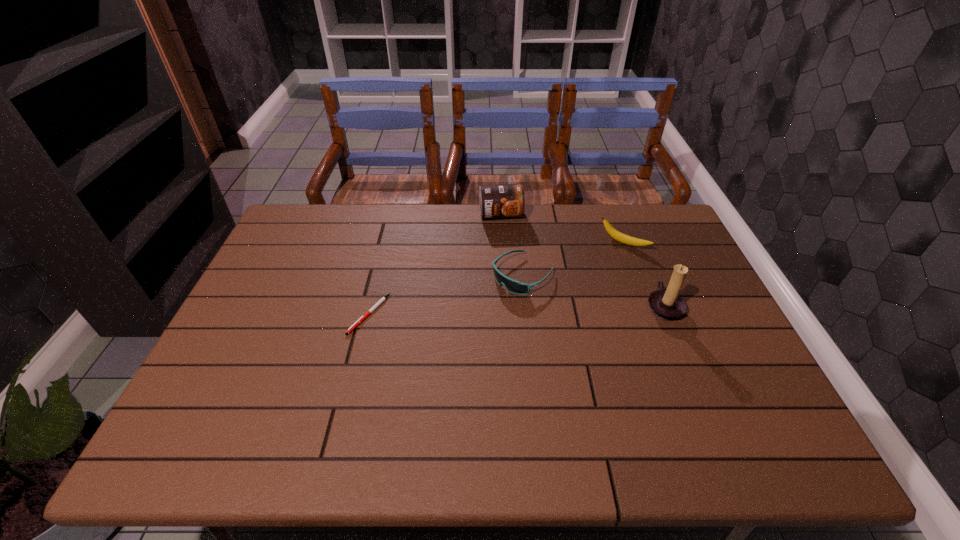
Where is `the shortest object`? The width and height of the screenshot is (960, 540). the shortest object is located at coordinates (382, 299).

Identify the location of pen. (382, 299).

Locate an element on the screen. candle holder is located at coordinates (668, 305).

The width and height of the screenshot is (960, 540). What are the coordinates of `banana` in the screenshot? It's located at (616, 235).

Identify the location of sunglasses. This screenshot has height=540, width=960. (513, 286).

You are a GUI agent. You are given a task and a screenshot of the screen. Output one action in this format:
    pyautogui.click(x=<x>, y=<y>)
    Task: Click on the can
    Image resolution: width=960 pixels, height=540 pixels.
    Given the screenshot: What is the action you would take?
    pyautogui.click(x=505, y=200)

I want to click on the second tallest object, so click(x=505, y=200).

Locate an element on the screen. The image size is (960, 540). free location located on the clicker of the pen is located at coordinates (345, 413).

Identify the location of vacant position located 0.060m on the wick of the tallest object. (703, 307).

Find the location of `free space located 0.060m on the upward curve of the banana`. free space located 0.060m on the upward curve of the banana is located at coordinates (x=604, y=261).